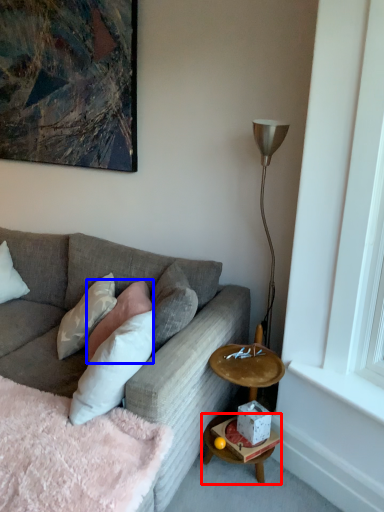
Question: Which object is closer to the camera taking this photo, table (highlighted by a red box) or pillow (highlighted by a blue box)?

Choices:
 (A) table
 (B) pillow

Answer: (A)